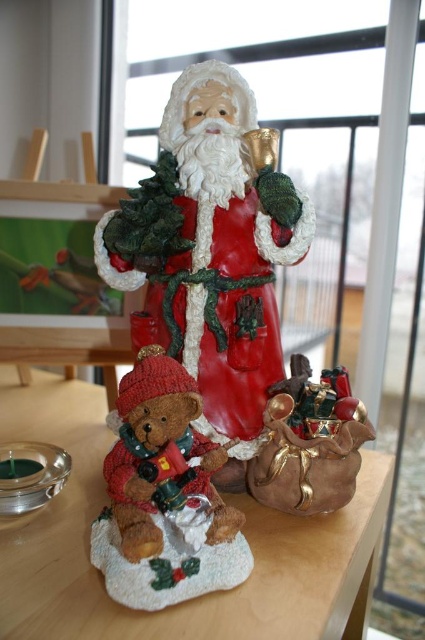
Does brown matte table at center appear on the right side of shiny brown leather bag at center?

No, brown matte table at center is not to the right of shiny brown leather bag at center.

Who is more forward, (x=99, y=451) or (x=288, y=481)?

Point (x=288, y=481)

Which is in front, point (61, 516) or point (292, 385)?

Point (61, 516) is more forward.

Locate an element on the screen. The height and width of the screenshot is (640, 425). brown matte table at center is located at coordinates (195, 598).

Can you confirm if red glossy santa claus at center is positioned above brown matte table at center?

Yes, red glossy santa claus at center is above brown matte table at center.

Can you confirm if red glossy santa claus at center is thinner than brown matte table at center?

Correct, red glossy santa claus at center's width is less than brown matte table at center's.

You are a GUI agent. You are given a task and a screenshot of the screen. Output one action in this format:
    pyautogui.click(x=<x>, y=<y>)
    Task: Click on the red glossy santa claus at center
    This screenshot has height=640, width=425.
    Given the screenshot: What is the action you would take?
    pyautogui.click(x=210, y=253)

Can you confirm if brown matte table at center is smaller than knitted teddy bear at lower left?

No.

Looking at this image, between brown matte table at center and knitted teddy bear at lower left, which one is positioned lower?

brown matte table at center is below.

What do you see at coordinates (195, 598) in the screenshot? The height and width of the screenshot is (640, 425). I see `brown matte table at center` at bounding box center [195, 598].

At what (x,y) coordinates should I click in order to perform the action: click on brown matte table at center. Please return your answer as a coordinate pair (x, y). This screenshot has width=425, height=640. Looking at the image, I should click on (195, 598).